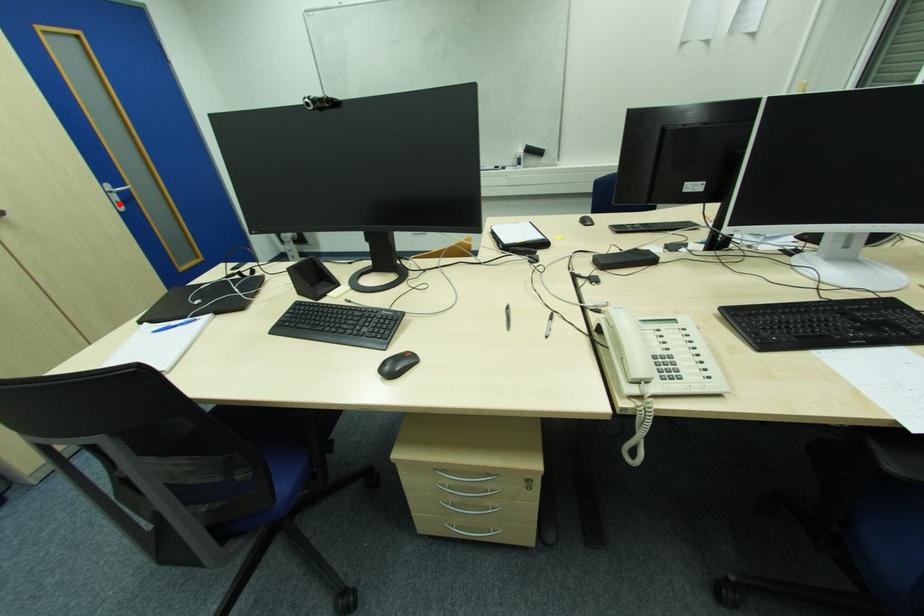
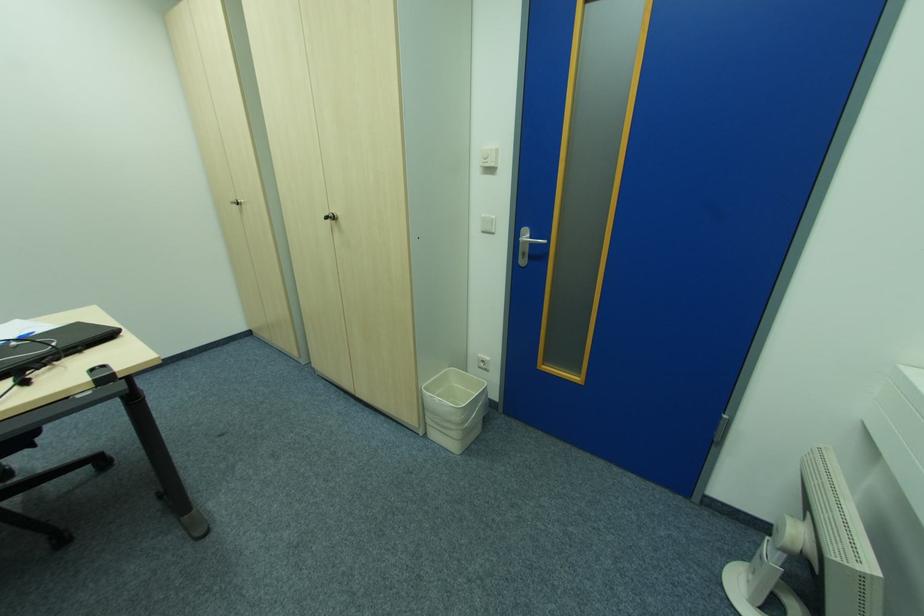
Question: A red point is marked in image1. In image2, is the corresponding 3D point closer to the camera or farther? Reply with the corresponding letter.

Choices:
 (A) The corresponding 3D point is closer.
 (B) The corresponding 3D point is farther.

Answer: (A)